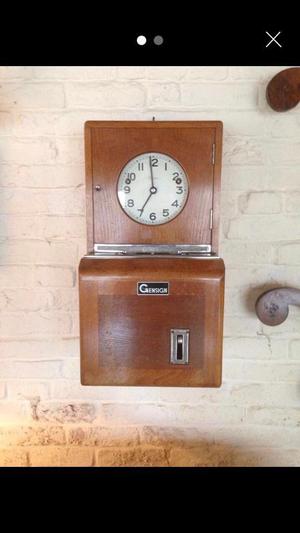
What are the coordinates of `door handle` in the screenshot? It's located at (281, 309).